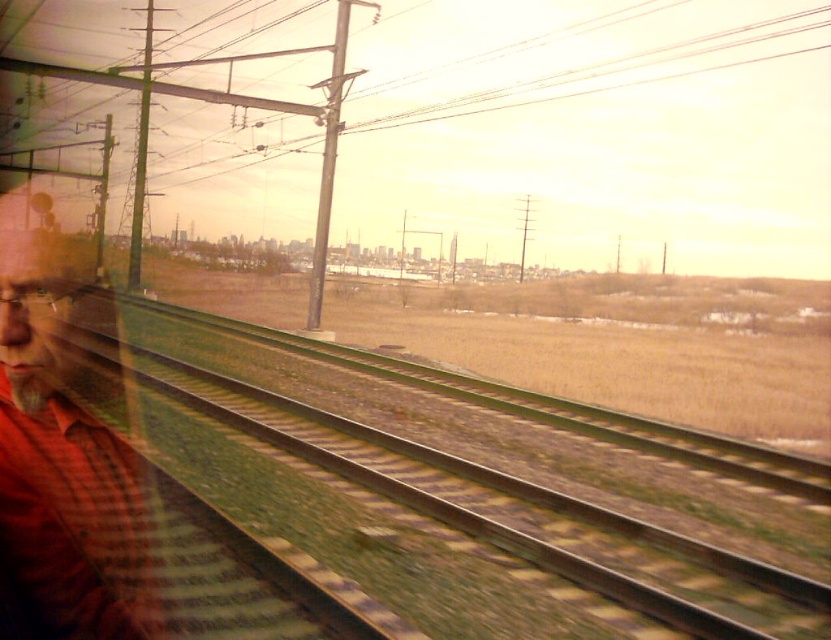
Who is lower down, green metallic track at center or red plaid shirt at left?

green metallic track at center

Does green metallic track at center come in front of red plaid shirt at left?

No, green metallic track at center is behind red plaid shirt at left.

Does point (543, 499) lie in front of point (17, 566)?

That is False.

Find the location of `green metallic track at center`. green metallic track at center is located at coordinates (485, 500).